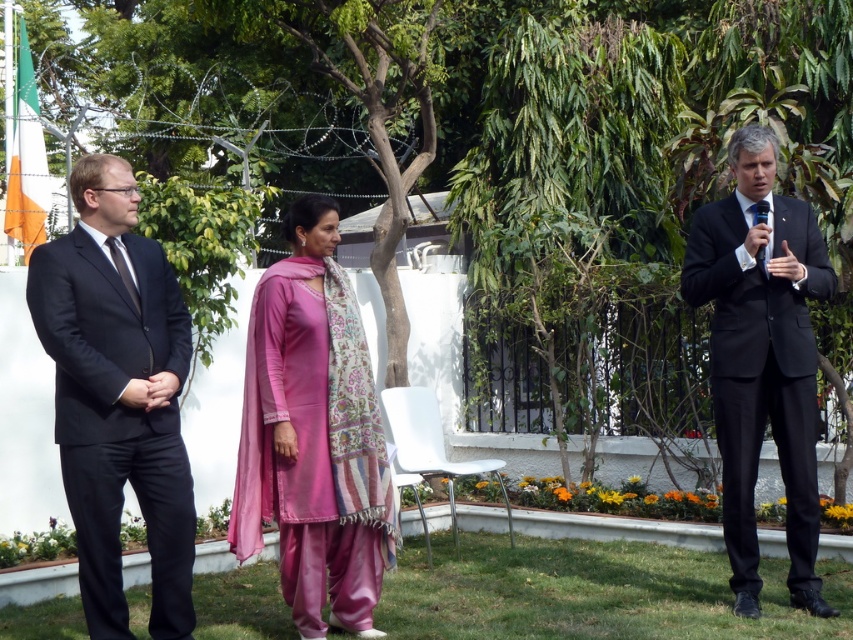
Question: Which of the following is the closest to the observer?

Choices:
 (A) matte black suit at left
 (B) pink satin kurta at center

Answer: (A)

Question: Estimate the real-world distances between objects in this image. Which object is closer to the matte black suit at left?

Choices:
 (A) pink satin kurta at center
 (B) matte black suit at right

Answer: (A)

Question: Is matte black suit at left smaller than matte black suit at right?

Choices:
 (A) no
 (B) yes

Answer: (A)

Question: Does matte black suit at left have a larger size compared to matte black suit at right?

Choices:
 (A) no
 (B) yes

Answer: (B)

Question: Which point is closer to the camera?

Choices:
 (A) matte black suit at right
 (B) pink satin kurta at center
 (C) matte black suit at left

Answer: (C)

Question: Where is matte black suit at left located in relation to matte black suit at right in the image?

Choices:
 (A) above
 (B) below

Answer: (B)